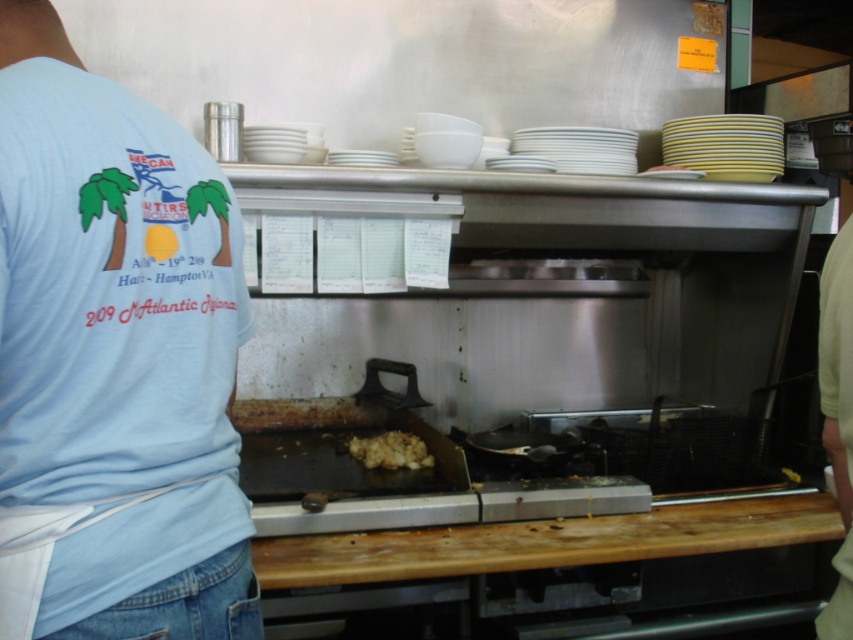
Question: In this image, where is light blue fabric shirt at upper left located relative to brown crumbly food at center?

Choices:
 (A) right
 (B) left

Answer: (B)

Question: Can you confirm if light blue fabric shirt at upper left is positioned above brown crumbly food at center?

Choices:
 (A) yes
 (B) no

Answer: (A)

Question: Is light blue fabric shirt at upper left below brown crumbly food at center?

Choices:
 (A) yes
 (B) no

Answer: (B)